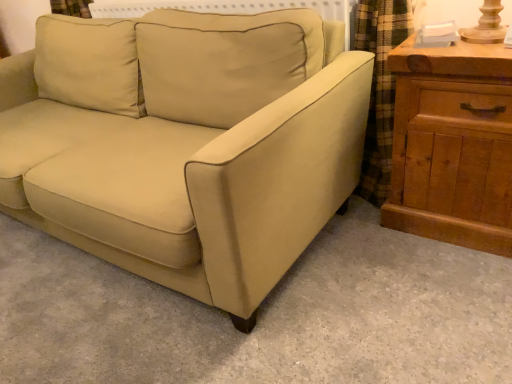
Question: Based on their positions, is wooden chest of drawers at right located to the left or right of beige fabric couch at center?

Choices:
 (A) left
 (B) right

Answer: (B)

Question: From the image's perspective, is wooden chest of drawers at right located above or below beige fabric couch at center?

Choices:
 (A) below
 (B) above

Answer: (A)

Question: In terms of width, does wooden chest of drawers at right look wider or thinner when compared to beige fabric couch at center?

Choices:
 (A) thin
 (B) wide

Answer: (A)

Question: Considering their positions, is beige fabric couch at center located in front of or behind wooden chest of drawers at right?

Choices:
 (A) front
 (B) behind

Answer: (A)

Question: Choose the correct answer: Is beige fabric couch at center inside wooden chest of drawers at right or outside it?

Choices:
 (A) inside
 (B) outside

Answer: (B)

Question: Based on their sizes in the image, would you say beige fabric couch at center is bigger or smaller than wooden chest of drawers at right?

Choices:
 (A) big
 (B) small

Answer: (A)

Question: In terms of height, does beige fabric couch at center look taller or shorter compared to wooden chest of drawers at right?

Choices:
 (A) tall
 (B) short

Answer: (A)